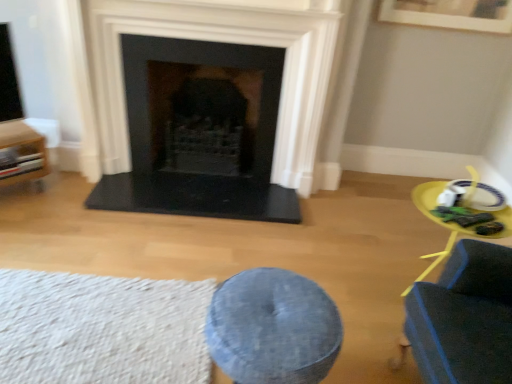
Find the location of `free space above white textured rug at lower left (from a real-world perspective)`. free space above white textured rug at lower left (from a real-world perspective) is located at coordinates (56, 318).